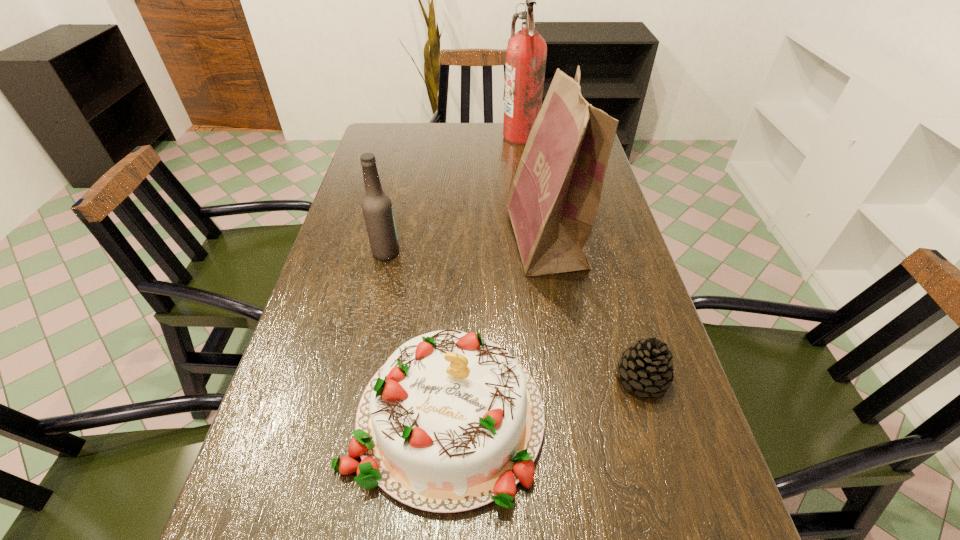
At what (x,y) coordinates should I click in order to perform the action: click on the farthest object. Please return your answer as a coordinate pair (x, y). This screenshot has width=960, height=540. Looking at the image, I should click on (526, 53).

This screenshot has width=960, height=540. Identify the location of grocery bag. (553, 201).

I want to click on beer bottle, so (377, 209).

At what (x,y) coordinates should I click in order to perform the action: click on the second shortest object. Please return your answer as a coordinate pair (x, y). The image size is (960, 540). Looking at the image, I should click on (451, 422).

Where is `pinecone`? pinecone is located at coordinates (646, 366).

At what (x,y) coordinates should I click in order to perform the action: click on vacant space positioned 0.310m on the front of the fire extinguisher near the operation label. Please return your answer as a coordinate pair (x, y). The width and height of the screenshot is (960, 540). Looking at the image, I should click on (418, 136).

Where is `free location located 0.190m on the front of the fire extinguisher near the operation label`? free location located 0.190m on the front of the fire extinguisher near the operation label is located at coordinates (450, 136).

You are a GUI agent. You are given a task and a screenshot of the screen. Output one action in this format:
    pyautogui.click(x=<x>, y=<y>)
    Task: Click on the free space located on the front of the fire extinguisher near the operation label
    Image resolution: width=960 pixels, height=540 pixels.
    Given the screenshot: What is the action you would take?
    pyautogui.click(x=468, y=136)

The image size is (960, 540). I want to click on vacant space located 0.300m on the front-facing side of the grocery bag, so click(397, 240).

Identify the location of free space located 0.170m on the front-facing side of the grocery bag. [445, 240].